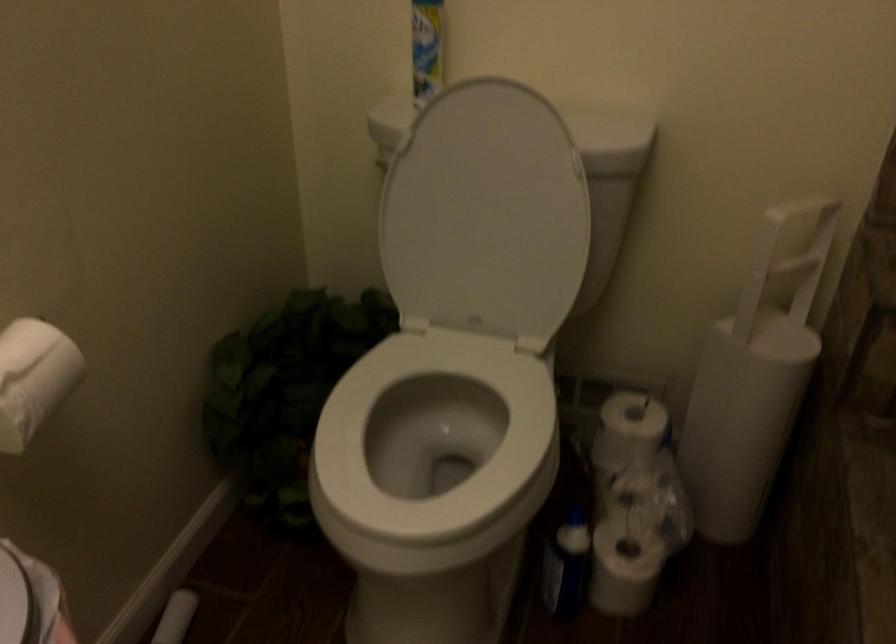
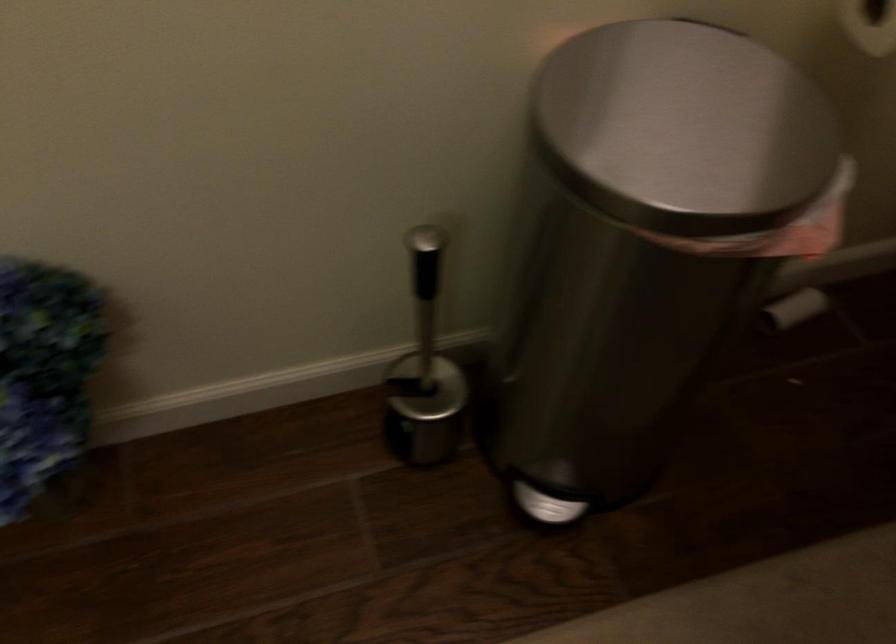
The images are taken continuously from a first-person perspective. In which direction is your viewpoint rotating?

The rotation direction of the camera is left-down.